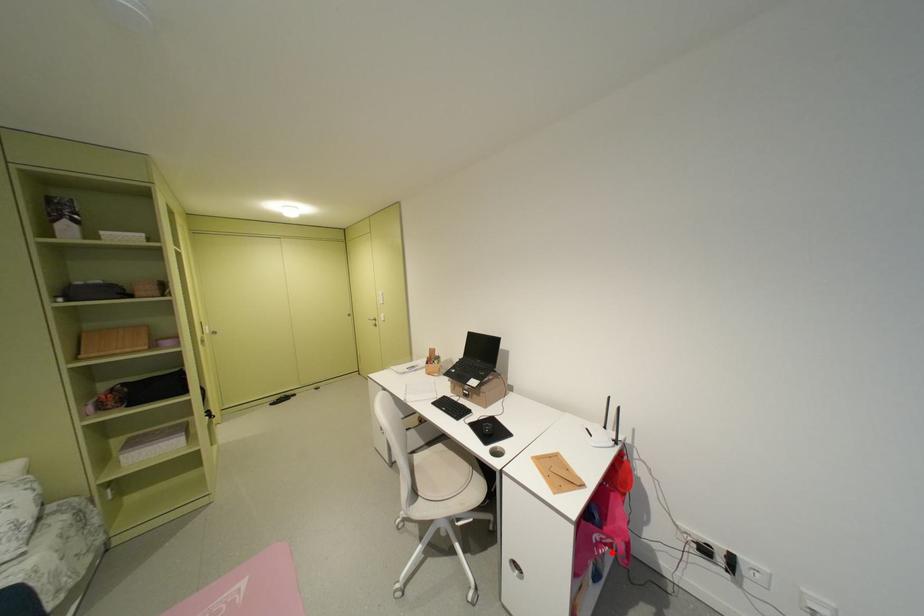
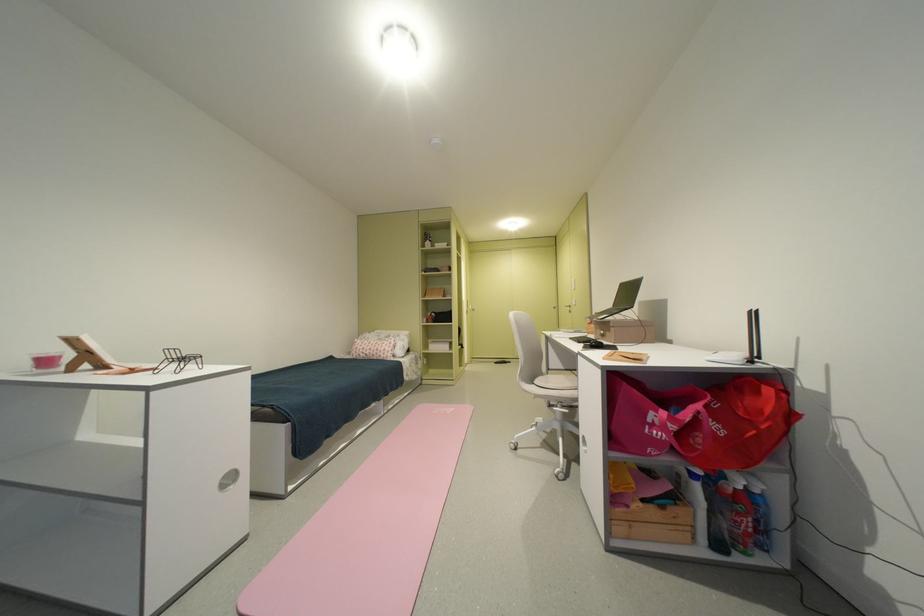
Locate, in the second image, the point that corresponds to the highlighted location in the first image.

(665, 432)